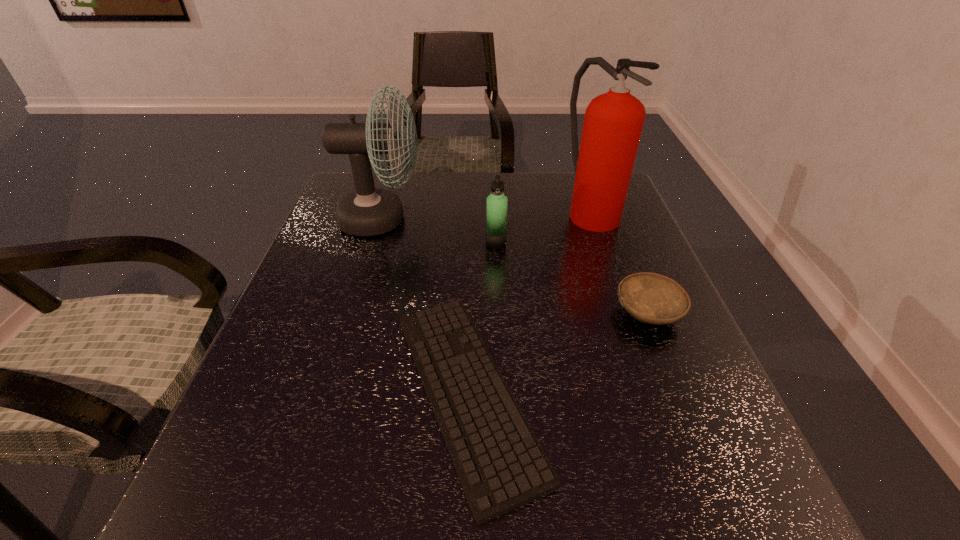
Find the location of a particular element. This screenshot has width=960, height=540. vacant region that satisfies the following two spatial constraints: 1. in front of the second shortest object where the airflow is directed; 2. on the left side of the fan is located at coordinates (353, 313).

Where is `free space in the image that satisfies the following two spatial constraints: 1. in front of the shortest object where the airflow is directed; 2. on the right side of the fan`? free space in the image that satisfies the following two spatial constraints: 1. in front of the shortest object where the airflow is directed; 2. on the right side of the fan is located at coordinates (329, 392).

The width and height of the screenshot is (960, 540). I want to click on blank space that satisfies the following two spatial constraints: 1. in front of the second shortest object where the airflow is directed; 2. on the left side of the fan, so click(x=353, y=313).

At what (x,y) coordinates should I click in order to perform the action: click on vacant space that satisfies the following two spatial constraints: 1. on the handle side of the fire extinguisher; 2. on the right side of the second shortest object. Please return your answer as a coordinate pair (x, y). This screenshot has height=540, width=960. Looking at the image, I should click on pos(627,313).